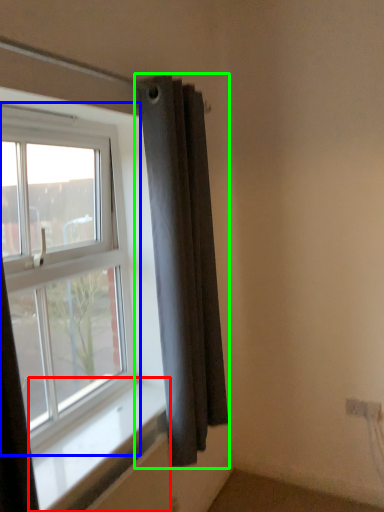
Question: Considering the real-world distances, which object is closest to window sill (highlighted by a red box)? window (highlighted by a blue box) or curtain (highlighted by a green box).

Choices:
 (A) window
 (B) curtain

Answer: (A)